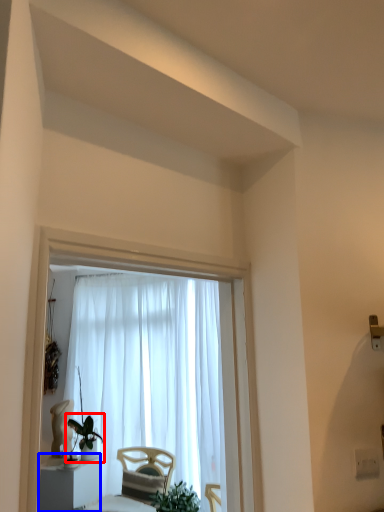
Question: Which object appears closest to the camera in this image, houseplant (highlighted by a red box) or furniture (highlighted by a blue box)?

Choices:
 (A) houseplant
 (B) furniture

Answer: (B)